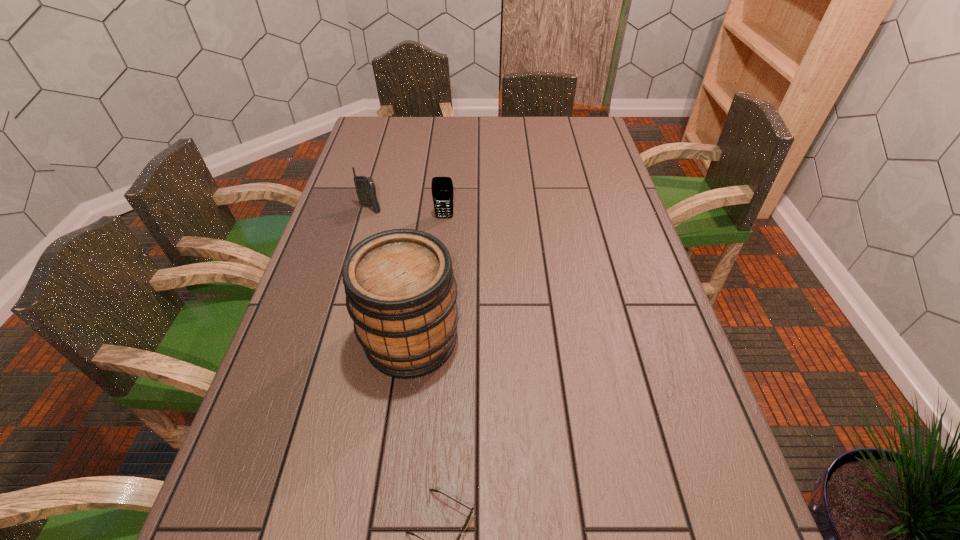
In the image, there is a desktop. At what (x,y) coordinates should I click in order to perform the action: click on free space at the far edge. Please return your answer as a coordinate pair (x, y). The height and width of the screenshot is (540, 960). Looking at the image, I should click on (523, 141).

Where is `free space at the left edge`? This screenshot has height=540, width=960. free space at the left edge is located at coordinates (267, 489).

In the image, there is a desktop. At what (x,y) coordinates should I click in order to perform the action: click on free space at the right edge. Please return your answer as a coordinate pair (x, y). Looking at the image, I should click on (577, 157).

In the image, there is a desktop. At what (x,y) coordinates should I click in order to perform the action: click on vacant region at the far right corner. Please return your answer as a coordinate pair (x, y). Image resolution: width=960 pixels, height=540 pixels. Looking at the image, I should click on (588, 116).

Locate an element on the screen. The width and height of the screenshot is (960, 540). free spot between the nearer cellular telephone and the left cellular telephone is located at coordinates (407, 214).

Select which object appears as the second closest to the sunglasses. Please provide its 2D coordinates. Your answer should be formatted as a tuple, i.e. [(x, y)], where the tuple contains the x and y coordinates of a point satisfying the conditions above.

[(442, 187)]

This screenshot has width=960, height=540. In order to click on object that can be found as the second closest to the leftmost object in this screenshot , I will do `click(401, 292)`.

Where is `blank area in the image that satisfies the following two spatial constraints: 1. on the keyboard of the cider; 2. on the left side of the farther cellular telephone`? This screenshot has width=960, height=540. blank area in the image that satisfies the following two spatial constraints: 1. on the keyboard of the cider; 2. on the left side of the farther cellular telephone is located at coordinates (334, 340).